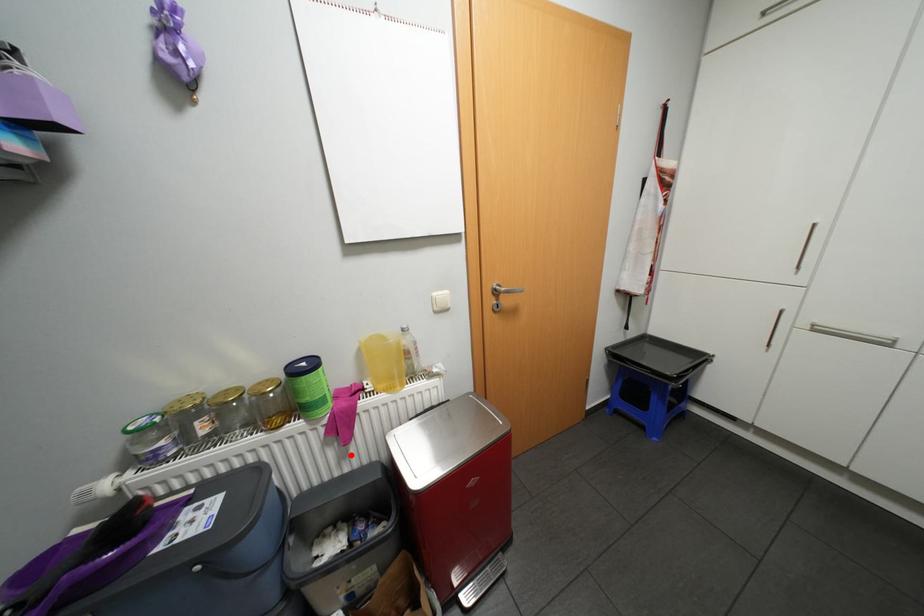
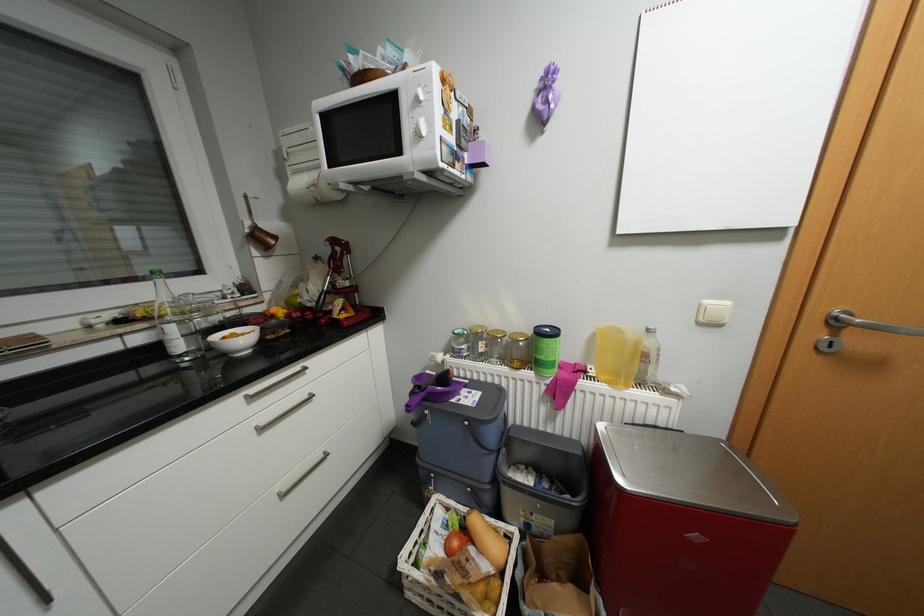
Locate, in the second image, the point that corresponds to the highlighted location in the first image.

(558, 416)